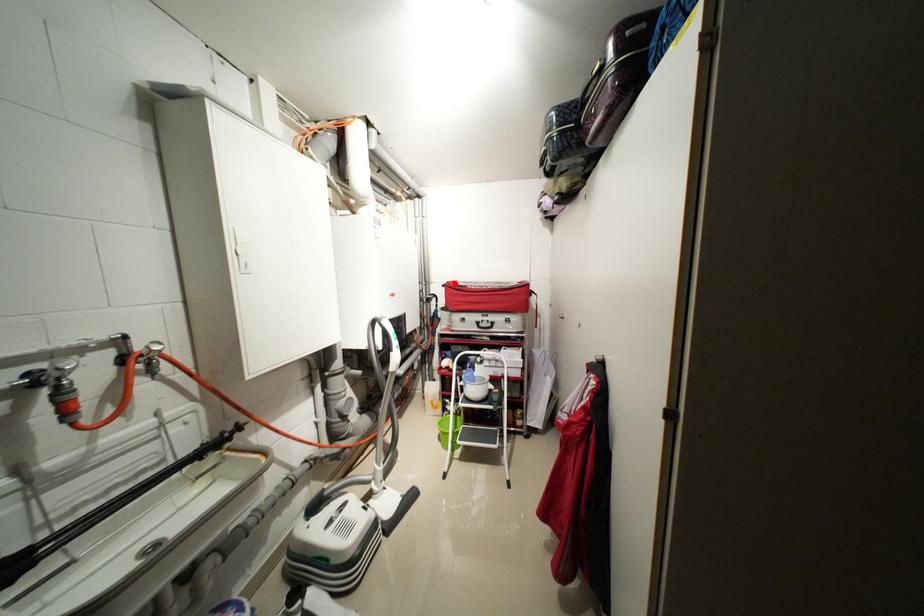
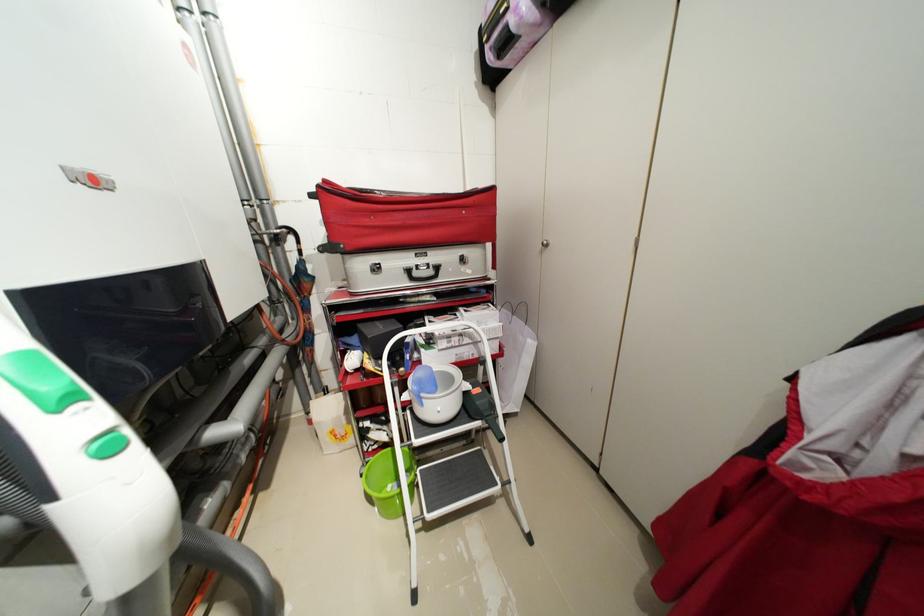
Where in the second image is the point corresponding to the highlighted location from the first image?

(332, 182)